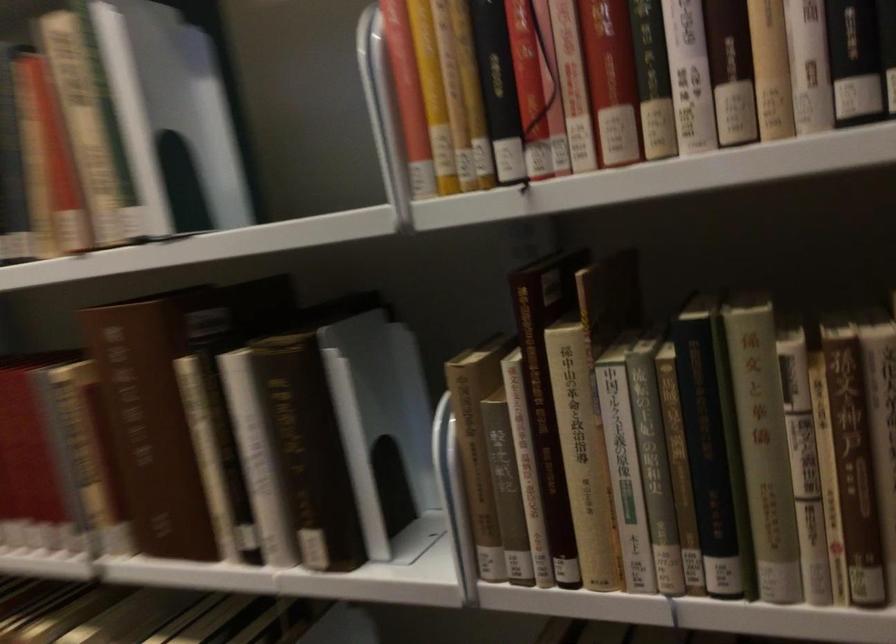
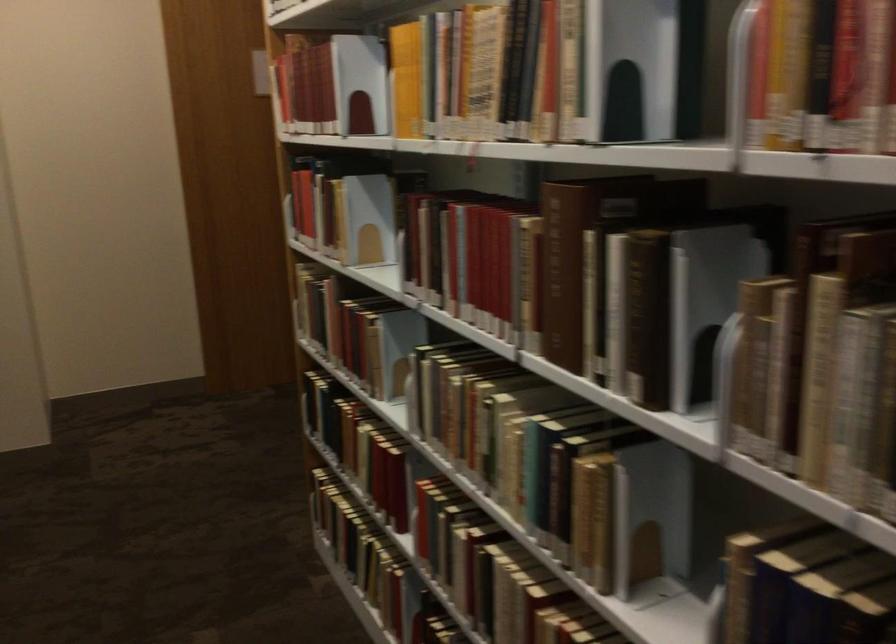
Question: How did the camera likely rotate?

Choices:
 (A) Left
 (B) Right
 (C) Up
 (D) Down

Answer: (A)